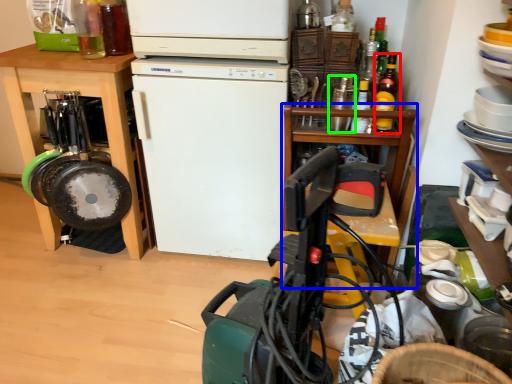
Question: Considering the real-world distances, which object is closest to bottle (highlighted by a red box)? table (highlighted by a blue box) or bottle (highlighted by a green box).

Choices:
 (A) table
 (B) bottle

Answer: (B)